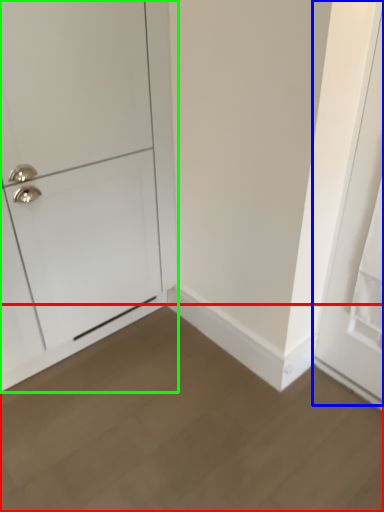
Question: Which object is positioned closest to plain (highlighted by a red box)? Select from door (highlighted by a blue box) and door (highlighted by a green box).

Choices:
 (A) door
 (B) door

Answer: (A)